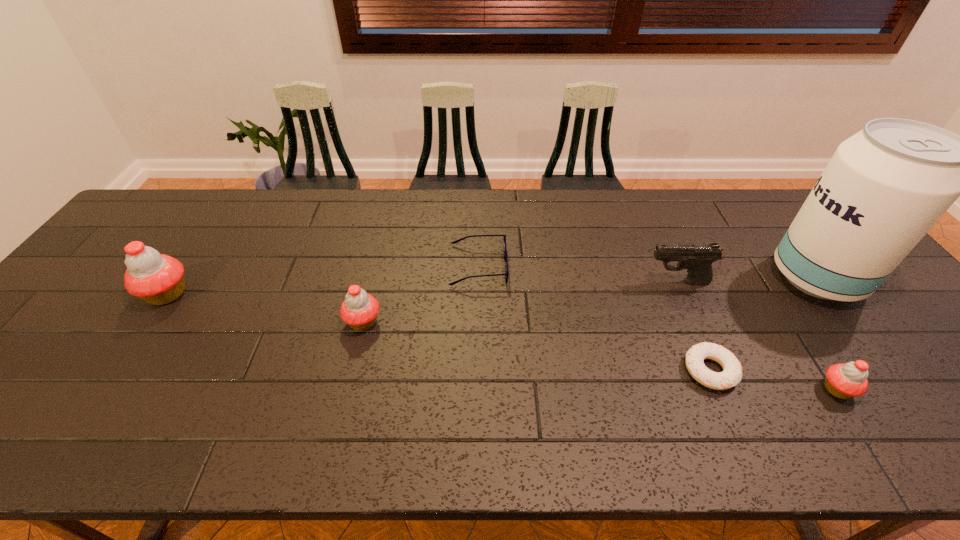
Locate an element on the screen. This screenshot has width=960, height=540. vacant region that satisfies the following two spatial constraints: 1. at the barrel of the pistol; 2. on the front side of the second tallest object is located at coordinates (684, 294).

The width and height of the screenshot is (960, 540). In order to click on free location that satisfies the following two spatial constraints: 1. on the front-facing side of the sixth tallest object; 2. on the right side of the third shortest object in this screenshot , I will do `click(478, 389)`.

Image resolution: width=960 pixels, height=540 pixels. In order to click on vacant region that satisfies the following two spatial constraints: 1. on the front-facing side of the spectacles; 2. on the back side of the alcohol in this screenshot , I will do `click(478, 278)`.

Locate an element on the screen. vacant space that satisfies the following two spatial constraints: 1. on the front-facing side of the sixth tallest object; 2. on the left side of the doughnut is located at coordinates (478, 370).

Find the location of a particular element. vacant region that satisfies the following two spatial constraints: 1. on the back side of the doughnut; 2. on the front-facing side of the spectacles is located at coordinates (665, 266).